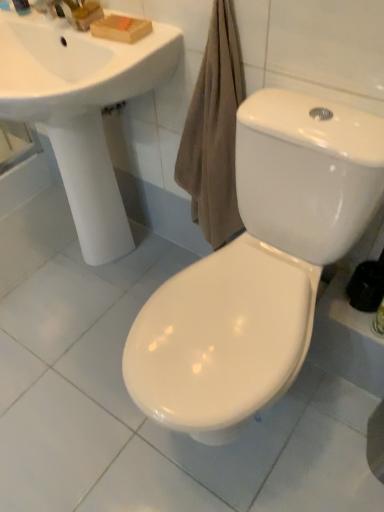
Question: From a real-world perspective, is white glossy toilet at center physically located above or below white glossy sink at upper left?

Choices:
 (A) above
 (B) below

Answer: (B)

Question: Considering the relative positions of white glossy toilet at center and white glossy sink at upper left in the image provided, is white glossy toilet at center to the left or to the right of white glossy sink at upper left?

Choices:
 (A) right
 (B) left

Answer: (A)

Question: Considering the real-world distances, which object is closest to the white glossy toilet at center?

Choices:
 (A) matte plastic soap at upper left
 (B) white glossy sink at upper left

Answer: (B)

Question: Which object is the farthest from the matte plastic soap at upper left?

Choices:
 (A) white glossy toilet at center
 (B) white glossy sink at upper left

Answer: (A)